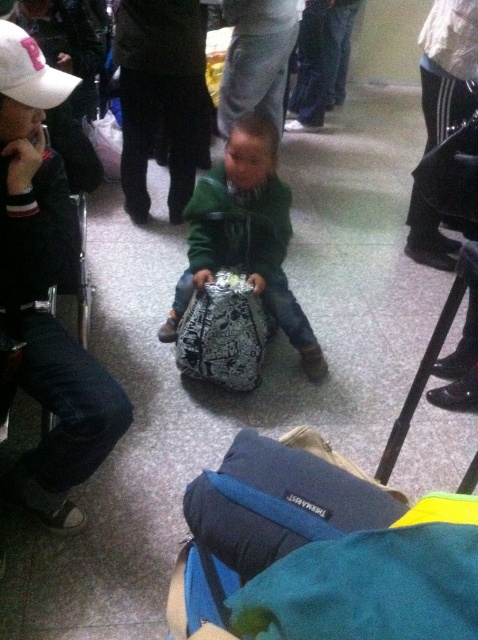
Question: Is metallic silver bag at center smaller than white matte baseball cap at upper left?

Choices:
 (A) yes
 (B) no

Answer: (B)

Question: Which object is closer to the camera taking this photo?

Choices:
 (A) metallic silver bag at center
 (B) white matte baseball cap at upper left

Answer: (B)

Question: Where is green matte jacket at center located in relation to metallic silver bag at center in the image?

Choices:
 (A) below
 (B) above

Answer: (B)

Question: Which point is closer to the camera?

Choices:
 (A) metallic silver bag at center
 (B) white matte baseball cap at upper left
 (C) green matte jacket at center

Answer: (B)

Question: Which of the following is the farthest from the observer?

Choices:
 (A) (2, 84)
 (B) (318, 364)
 (C) (214, 301)

Answer: (B)

Question: Does metallic silver bag at center appear on the left side of white matte baseball cap at upper left?

Choices:
 (A) yes
 (B) no

Answer: (B)